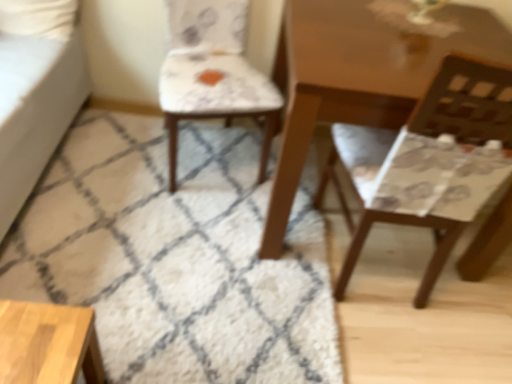
You are a GUI agent. You are given a task and a screenshot of the screen. Output one action in this format:
    pyautogui.click(x=<x>, y=<y>)
    Task: Click on the free space in front of patterned fabric chair at center, the second chair viewed from the right
    This screenshot has height=384, width=512.
    Given the screenshot: What is the action you would take?
    pyautogui.click(x=178, y=222)